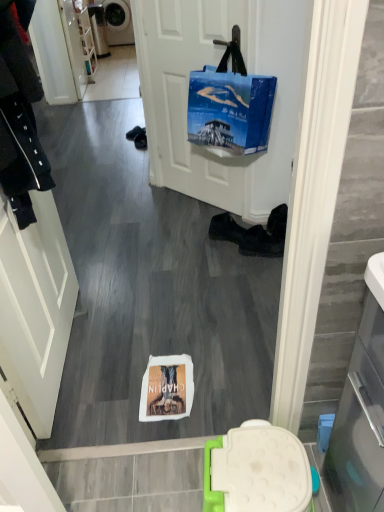
Where is `vacant space to the left of white matte door at center`? Image resolution: width=384 pixels, height=512 pixels. vacant space to the left of white matte door at center is located at coordinates (140, 204).